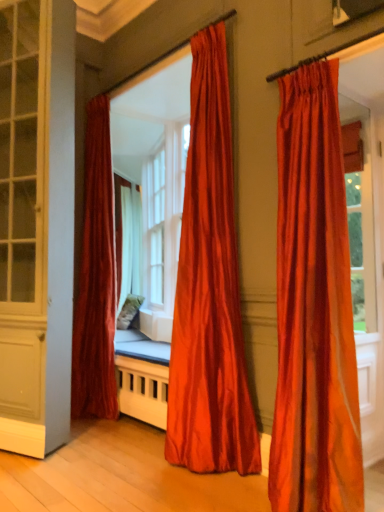
Locate an element on the screen. The height and width of the screenshot is (512, 384). free space below satin orange curtain at center, which ranks as the 2th curtain in right-to-left order (from a real-world perspective) is located at coordinates (207, 476).